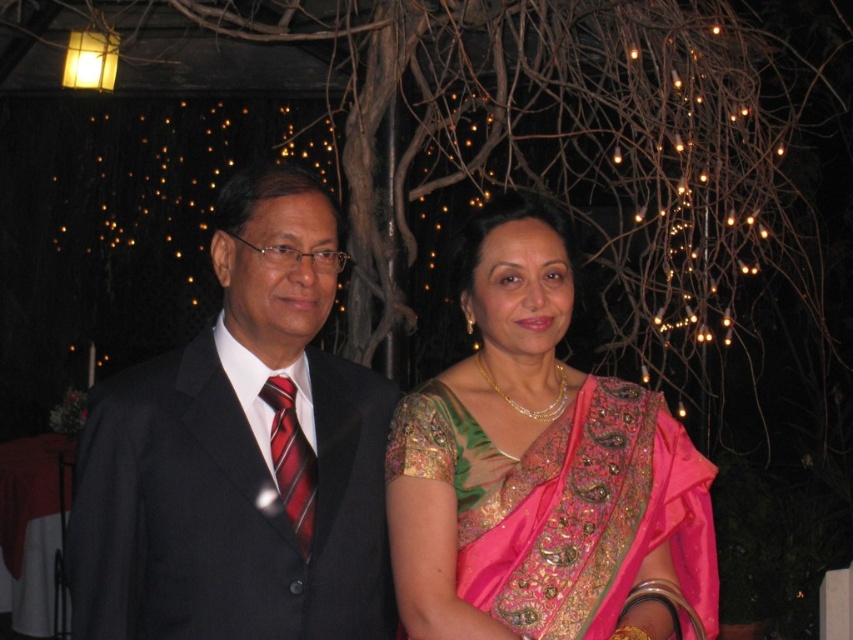
Which is below, pink embroidered saree at center or red striped tie at left?

red striped tie at left is lower down.

Is pink embroidered saree at center further to camera compared to red striped tie at left?

No, pink embroidered saree at center is in front of red striped tie at left.

Is point (695, 612) positioned in front of point (294, 412)?

No, it is behind (294, 412).

This screenshot has width=853, height=640. I want to click on pink embroidered saree at center, so click(543, 472).

Does shiny black suit at left appear on the right side of red striped tie at left?

Incorrect, shiny black suit at left is not on the right side of red striped tie at left.

Which is more to the left, shiny black suit at left or red striped tie at left?

Positioned to the left is shiny black suit at left.

The image size is (853, 640). Describe the element at coordinates (241, 454) in the screenshot. I see `shiny black suit at left` at that location.

The image size is (853, 640). Find the location of `shiny black suit at left`. shiny black suit at left is located at coordinates pyautogui.click(x=241, y=454).

Which is more to the left, shiny black suit at left or pink embroidered saree at center?

Positioned to the left is shiny black suit at left.

Where is `shiny black suit at left`? Image resolution: width=853 pixels, height=640 pixels. shiny black suit at left is located at coordinates (241, 454).

At what (x,y) coordinates should I click in order to perform the action: click on shiny black suit at left. Please return your answer as a coordinate pair (x, y). The image size is (853, 640). Looking at the image, I should click on (241, 454).